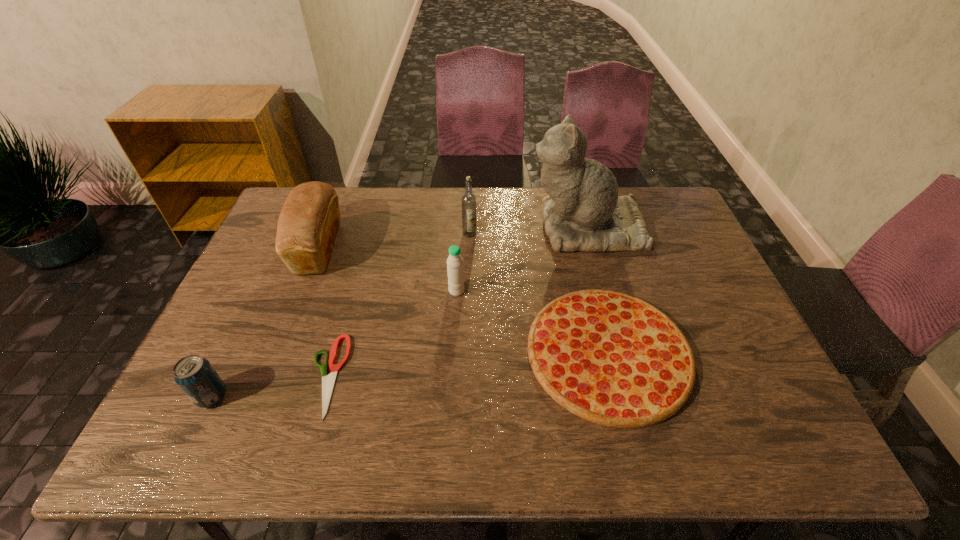
You are a GUI agent. You are given a task and a screenshot of the screen. Output one action in this format:
    pyautogui.click(x=<x>, y=<y>)
    Task: Click on the object that stands as the closest to the bread
    
    Given the screenshot: What is the action you would take?
    tap(328, 381)

Image resolution: width=960 pixels, height=540 pixels. In order to click on object that is the nearest to the water bottle in this screenshot , I will do `click(610, 358)`.

Where is `vacant space that satisfies the following two spatial constraints: 1. on the back side of the water bottle; 2. on the right side of the third shortest object`? Image resolution: width=960 pixels, height=540 pixels. vacant space that satisfies the following two spatial constraints: 1. on the back side of the water bottle; 2. on the right side of the third shortest object is located at coordinates (263, 291).

The height and width of the screenshot is (540, 960). Identify the location of free space in the image that satisfies the following two spatial constraints: 1. on the back side of the leftmost object; 2. on the right side of the scissors. (222, 375).

Find the location of a particular element. The image size is (960, 540). free spot that satisfies the following two spatial constraints: 1. on the label of the second shortest object; 2. on the right side of the second tallest object is located at coordinates (467, 353).

Where is `blank area in the image that satisfies the following two spatial constraints: 1. on the back side of the sixth tallest object; 2. on the right side of the fifth object from right to left`? The width and height of the screenshot is (960, 540). blank area in the image that satisfies the following two spatial constraints: 1. on the back side of the sixth tallest object; 2. on the right side of the fifth object from right to left is located at coordinates pos(333,353).